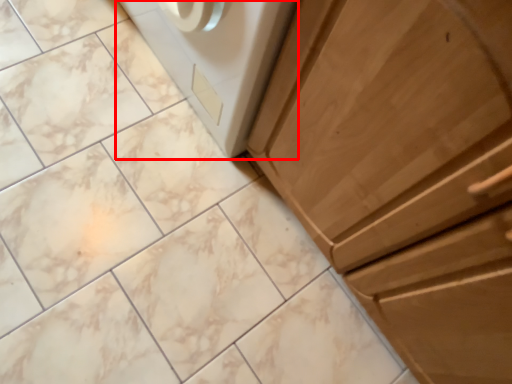
Question: From the image's perspective, what is the correct spatial relationship of home appliance (annotated by the red box) in relation to cabinetry?

Choices:
 (A) below
 (B) above

Answer: (B)